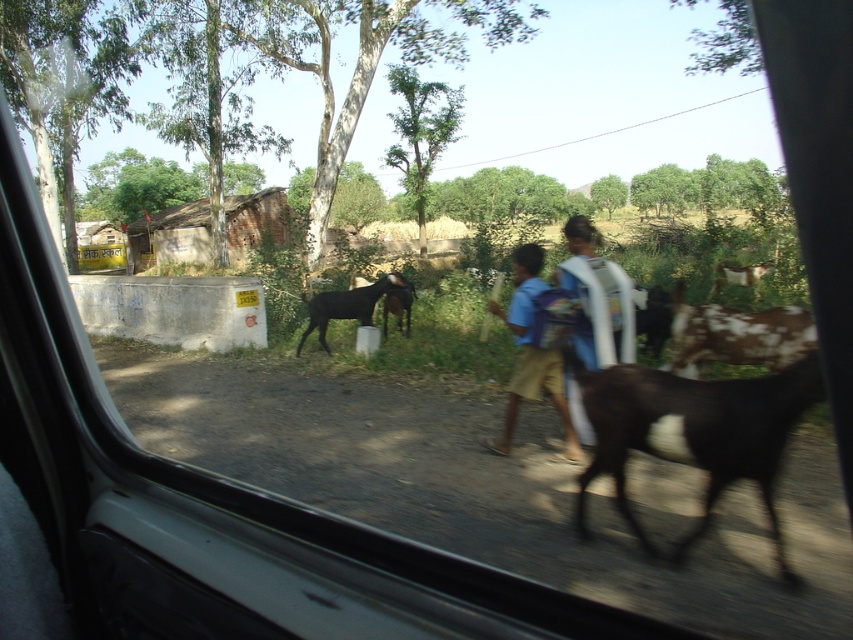
Which of these two, blue cotton shirt at center or black glossy goat at center, stands shorter?

With less height is black glossy goat at center.

Is point (556, 376) positioned in front of point (318, 321)?

Yes, point (556, 376) is closer to viewer.

This screenshot has height=640, width=853. I want to click on blue cotton shirt at center, so click(x=531, y=355).

Is blue cotton shirt at center above black fur goat at center?

No.

Who is taller, blue cotton shirt at center or black fur goat at center?

blue cotton shirt at center is taller.

Is point (521, 307) more distant than point (390, 307)?

No, it is in front of (390, 307).

In order to click on blue cotton shirt at center in this screenshot , I will do [x=531, y=355].

Does black fur goat at right have a greater height compared to blue cotton shirt at center?

Incorrect, black fur goat at right's height is not larger of blue cotton shirt at center's.

Which of these two, black fur goat at right or blue cotton shirt at center, stands shorter?

black fur goat at right is shorter.

What are the coordinates of `black fur goat at right` in the screenshot? It's located at (693, 433).